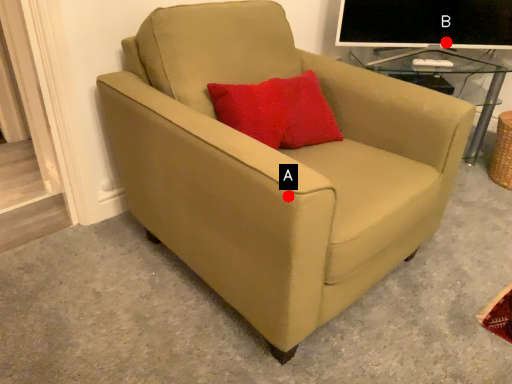
Question: Two points are circled on the image, labeled by A and B beside each circle. Which point appears farthest from the camera in this image?

Choices:
 (A) A is further
 (B) B is further

Answer: (B)